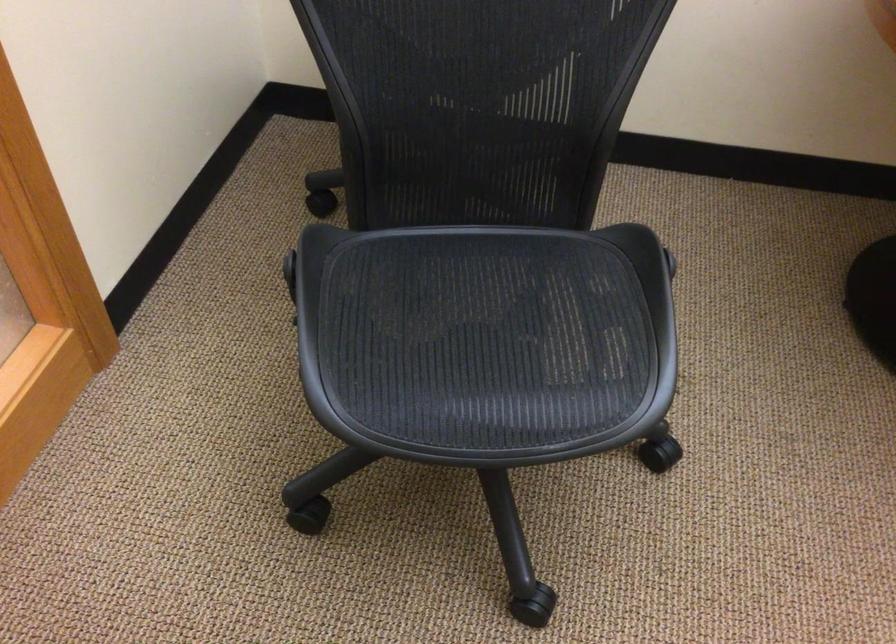
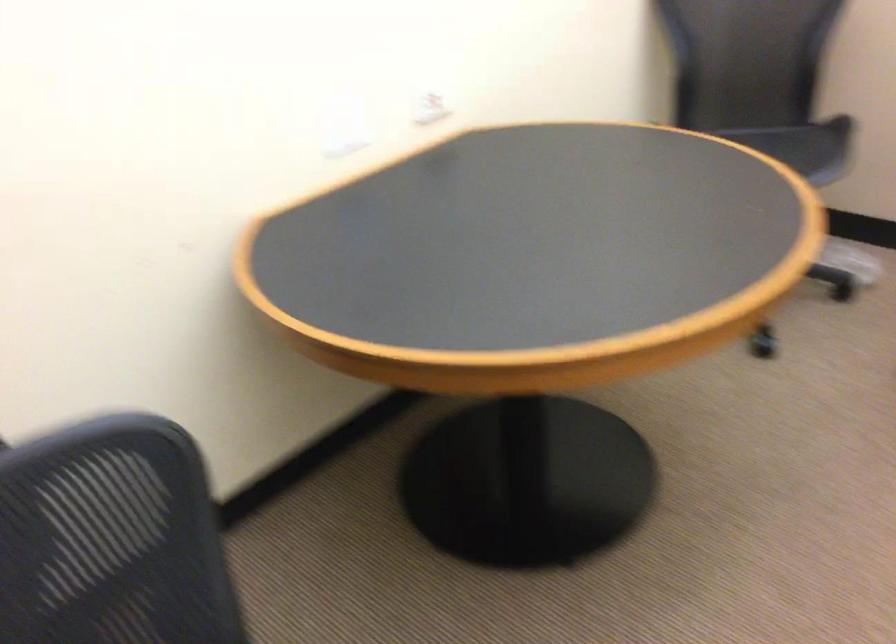
Question: The first image is from the beginning of the video and the second image is from the end. How did the camera likely rotate when shooting the video?

Choices:
 (A) Left
 (B) Right
 (C) Up
 (D) Down

Answer: (B)